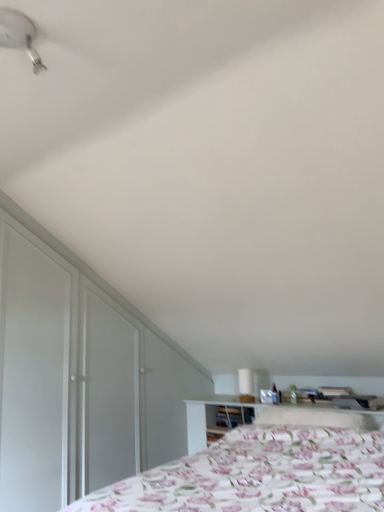
Question: Considering the relative sizes of white plastic fan at upper left and white glossy dresser at left in the image provided, is white plastic fan at upper left wider than white glossy dresser at left?

Choices:
 (A) yes
 (B) no

Answer: (A)

Question: Is white plastic fan at upper left not near white glossy dresser at left?

Choices:
 (A) no
 (B) yes

Answer: (B)

Question: Considering the relative sizes of white plastic fan at upper left and white glossy dresser at left in the image provided, is white plastic fan at upper left thinner than white glossy dresser at left?

Choices:
 (A) yes
 (B) no

Answer: (B)

Question: Is white plastic fan at upper left outside white glossy dresser at left?

Choices:
 (A) no
 (B) yes

Answer: (B)

Question: Can you confirm if white plastic fan at upper left is bigger than white glossy dresser at left?

Choices:
 (A) no
 (B) yes

Answer: (A)

Question: From the image's perspective, is white plastic fan at upper left located beneath white glossy dresser at left?

Choices:
 (A) yes
 (B) no

Answer: (B)

Question: From a real-world perspective, does fluffy white pillow at center sit lower than white glossy dresser at left?

Choices:
 (A) no
 (B) yes

Answer: (B)

Question: From a real-world perspective, is fluffy white pillow at center located higher than white glossy dresser at left?

Choices:
 (A) yes
 (B) no

Answer: (B)

Question: Does fluffy white pillow at center appear on the left side of white glossy dresser at left?

Choices:
 (A) yes
 (B) no

Answer: (B)

Question: Is fluffy white pillow at center thinner than white glossy dresser at left?

Choices:
 (A) yes
 (B) no

Answer: (B)

Question: Is fluffy white pillow at center not close to white glossy dresser at left?

Choices:
 (A) yes
 (B) no

Answer: (A)

Question: Is white glossy dresser at left a part of fluffy white pillow at center?

Choices:
 (A) no
 (B) yes

Answer: (A)

Question: Is fluffy white pillow at center closer to camera compared to white plastic fan at upper left?

Choices:
 (A) no
 (B) yes

Answer: (A)